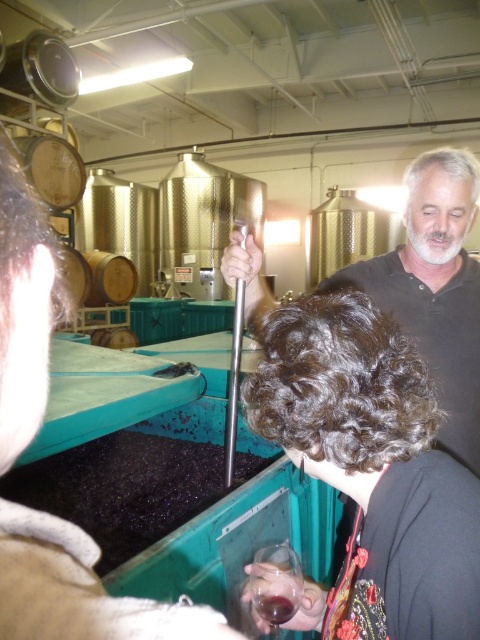
Question: Which object is farther from the camera taking this photo?

Choices:
 (A) transparent glass at lower center
 (B) translucent glass at center
 (C) black matte shirt at center
 (D) dark curly hair at center

Answer: (C)

Question: In this image, where is transparent glass at lower center located relative to translucent glass at center?

Choices:
 (A) below
 (B) above

Answer: (A)

Question: Considering the relative positions of transparent glass at lower center and wooden barrel at center in the image provided, where is transparent glass at lower center located with respect to wooden barrel at center?

Choices:
 (A) right
 (B) left

Answer: (A)

Question: Observing the image, what is the correct spatial positioning of black matte shirt at center in reference to wooden barrel at center?

Choices:
 (A) above
 (B) below

Answer: (B)

Question: Estimate the real-world distances between objects in this image. Which object is farther from the wooden barrel at center?

Choices:
 (A) dark curly hair at center
 (B) translucent glass at center

Answer: (B)

Question: Which point appears closest to the camera in this image?

Choices:
 (A) (107, 272)
 (B) (382, 323)

Answer: (B)